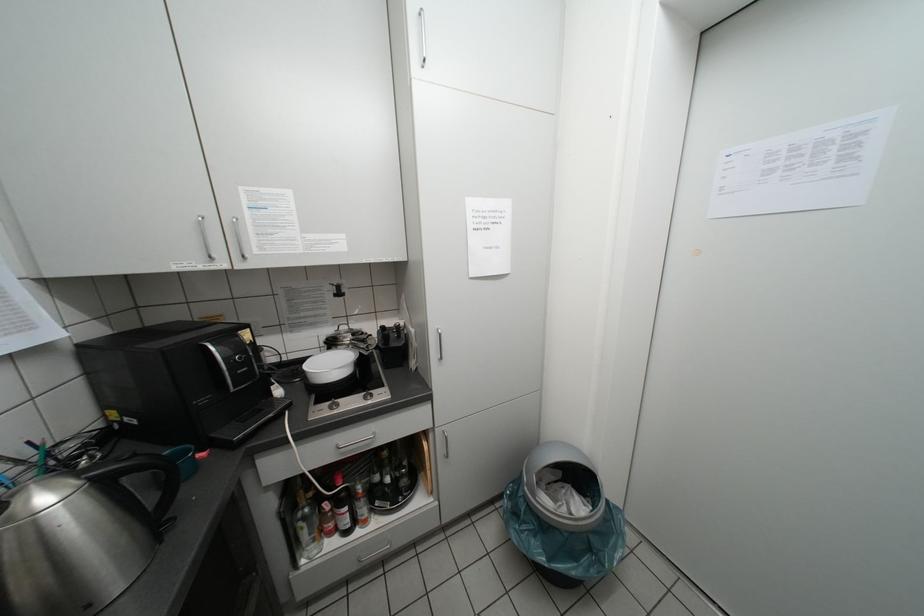
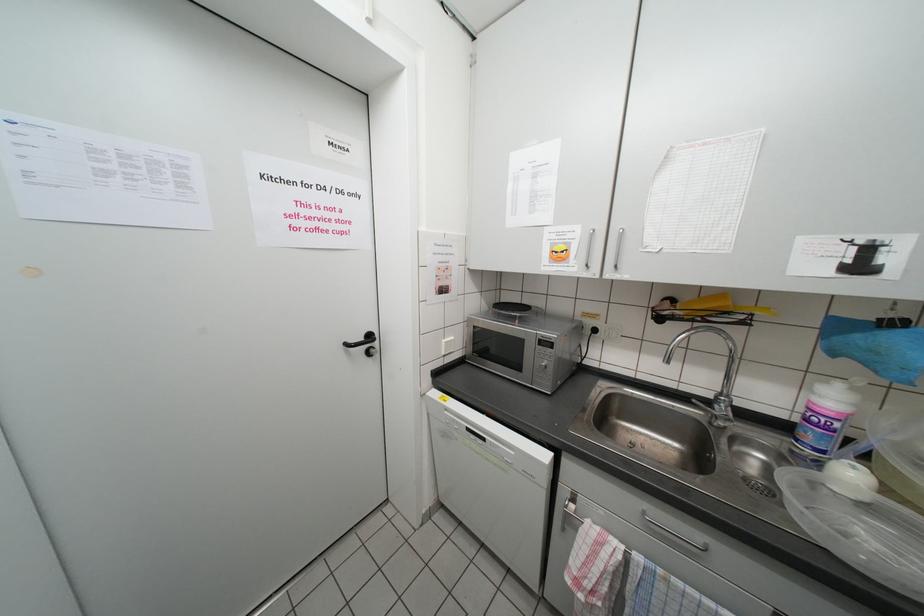
The first image is from the beginning of the video and the second image is from the end. How did the camera likely rotate when shooting the video?

The camera's rotation is toward right-down.